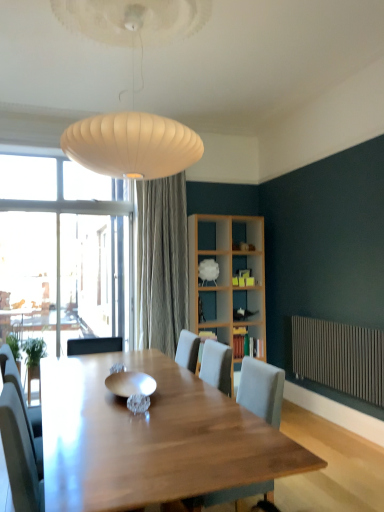
Question: Is wooden bookshelf at center, marked as the 3th shelf in a top-to-bottom arrangement, further to camera compared to wooden bookshelf at center, placed as the 2th shelf when sorted from top to bottom?

Choices:
 (A) no
 (B) yes

Answer: (B)

Question: From the image's perspective, is wooden bookshelf at center, positioned as the 1th shelf in bottom-to-top order, below wooden bookshelf at center, the second shelf ordered from the bottom?

Choices:
 (A) yes
 (B) no

Answer: (A)

Question: Is wooden bookshelf at center, positioned as the 1th shelf in bottom-to-top order, next to wooden bookshelf at center, placed as the 2th shelf when sorted from top to bottom?

Choices:
 (A) yes
 (B) no

Answer: (B)

Question: Is wooden bookshelf at center, positioned as the 1th shelf in bottom-to-top order, facing away from wooden bookshelf at center, the second shelf ordered from the bottom?

Choices:
 (A) no
 (B) yes

Answer: (A)

Question: Is wooden bookshelf at center, positioned as the 1th shelf in bottom-to-top order, outside of wooden bookshelf at center, the second shelf ordered from the bottom?

Choices:
 (A) no
 (B) yes

Answer: (B)

Question: From a real-world perspective, is wooden bookshelf at center, marked as the 3th shelf in a top-to-bottom arrangement, positioned above or below wooden bookshelf at center, placed as the 2th shelf when sorted from top to bottom?

Choices:
 (A) above
 (B) below

Answer: (B)

Question: From the image's perspective, is wooden bookshelf at center, positioned as the 1th shelf in bottom-to-top order, positioned above or below wooden bookshelf at center, the second shelf ordered from the bottom?

Choices:
 (A) below
 (B) above

Answer: (A)

Question: Based on their positions, is wooden bookshelf at center, marked as the 3th shelf in a top-to-bottom arrangement, located to the left or right of wooden bookshelf at center, placed as the 2th shelf when sorted from top to bottom?

Choices:
 (A) left
 (B) right

Answer: (B)

Question: Is wooden bookshelf at center, marked as the 3th shelf in a top-to-bottom arrangement, in front of or behind wooden bookshelf at center, the second shelf ordered from the bottom, in the image?

Choices:
 (A) behind
 (B) front

Answer: (A)

Question: Considering their positions, is wooden bookshelf at center, positioned as the 1th shelf in bottom-to-top order, located in front of or behind shiny metallic bowl at center?

Choices:
 (A) front
 (B) behind

Answer: (B)

Question: Is wooden bookshelf at center, positioned as the 1th shelf in bottom-to-top order, situated inside shiny metallic bowl at center or outside?

Choices:
 (A) inside
 (B) outside

Answer: (B)

Question: From a real-world perspective, relative to shiny metallic bowl at center, is wooden bookshelf at center, positioned as the 1th shelf in bottom-to-top order, vertically above or below?

Choices:
 (A) above
 (B) below

Answer: (B)

Question: From their relative heights in the image, would you say wooden bookshelf at center, marked as the 3th shelf in a top-to-bottom arrangement, is taller or shorter than shiny metallic bowl at center?

Choices:
 (A) short
 (B) tall

Answer: (B)

Question: From a real-world perspective, is shiny metallic bowl at center positioned above or below light gray fabric chair at center?

Choices:
 (A) above
 (B) below

Answer: (A)

Question: From the image's perspective, is shiny metallic bowl at center above or below light gray fabric chair at center?

Choices:
 (A) below
 (B) above

Answer: (B)